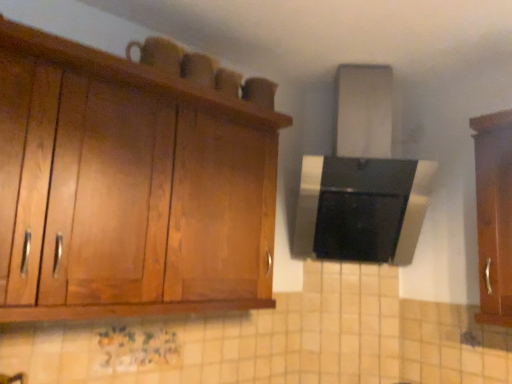
Question: Is wooden cabinet at right, which is the 1th cabinetry from right to left, positioned with its back to wooden cabinet at upper left, arranged as the 1th cabinetry when viewed from the left?

Choices:
 (A) no
 (B) yes

Answer: (A)

Question: Can wooden cabinet at upper left, arranged as the 1th cabinetry when viewed from the left, be found inside wooden cabinet at right, which is the 2th cabinetry in left-to-right order?

Choices:
 (A) no
 (B) yes

Answer: (A)

Question: Are wooden cabinet at right, which is the 1th cabinetry from right to left, and wooden cabinet at upper left, arranged as the 1th cabinetry when viewed from the left, located far from each other?

Choices:
 (A) no
 (B) yes

Answer: (B)

Question: Considering the relative positions of wooden cabinet at right, which is the 1th cabinetry from right to left, and wooden cabinet at upper left, the second cabinetry from the right, in the image provided, is wooden cabinet at right, which is the 1th cabinetry from right to left, in front of wooden cabinet at upper left, the second cabinetry from the right,?

Choices:
 (A) no
 (B) yes

Answer: (A)

Question: Does wooden cabinet at right, which is the 1th cabinetry from right to left, have a lesser height compared to wooden cabinet at upper left, the second cabinetry from the right?

Choices:
 (A) yes
 (B) no

Answer: (B)

Question: From a real-world perspective, does wooden cabinet at right, which is the 2th cabinetry in left-to-right order, stand above wooden cabinet at upper left, the second cabinetry from the right?

Choices:
 (A) no
 (B) yes

Answer: (B)

Question: Is wooden cabinet at upper left, arranged as the 1th cabinetry when viewed from the left, further to the viewer compared to wooden cabinet at right, which is the 1th cabinetry from right to left?

Choices:
 (A) no
 (B) yes

Answer: (A)

Question: Is wooden cabinet at upper left, the second cabinetry from the right, in front of wooden cabinet at right, which is the 2th cabinetry in left-to-right order?

Choices:
 (A) no
 (B) yes

Answer: (B)

Question: Considering the relative sizes of wooden cabinet at upper left, the second cabinetry from the right, and wooden cabinet at right, which is the 1th cabinetry from right to left, in the image provided, is wooden cabinet at upper left, the second cabinetry from the right, wider than wooden cabinet at right, which is the 1th cabinetry from right to left,?

Choices:
 (A) no
 (B) yes

Answer: (B)

Question: Is wooden cabinet at upper left, the second cabinetry from the right, bigger than wooden cabinet at right, which is the 1th cabinetry from right to left?

Choices:
 (A) no
 (B) yes

Answer: (B)

Question: From a real-world perspective, is wooden cabinet at upper left, the second cabinetry from the right, positioned under wooden cabinet at right, which is the 2th cabinetry in left-to-right order, based on gravity?

Choices:
 (A) yes
 (B) no

Answer: (A)

Question: From the image's perspective, is wooden cabinet at upper left, arranged as the 1th cabinetry when viewed from the left, over wooden cabinet at right, which is the 2th cabinetry in left-to-right order?

Choices:
 (A) yes
 (B) no

Answer: (A)

Question: From a real-world perspective, is wooden cabinet at upper left, the second cabinetry from the right, above or below wooden cabinet at right, which is the 1th cabinetry from right to left?

Choices:
 (A) below
 (B) above

Answer: (A)